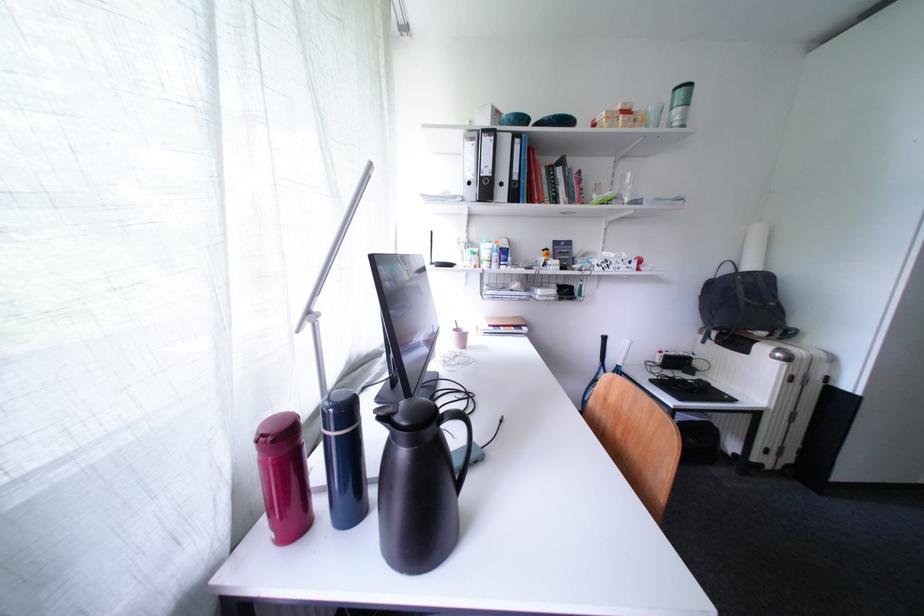
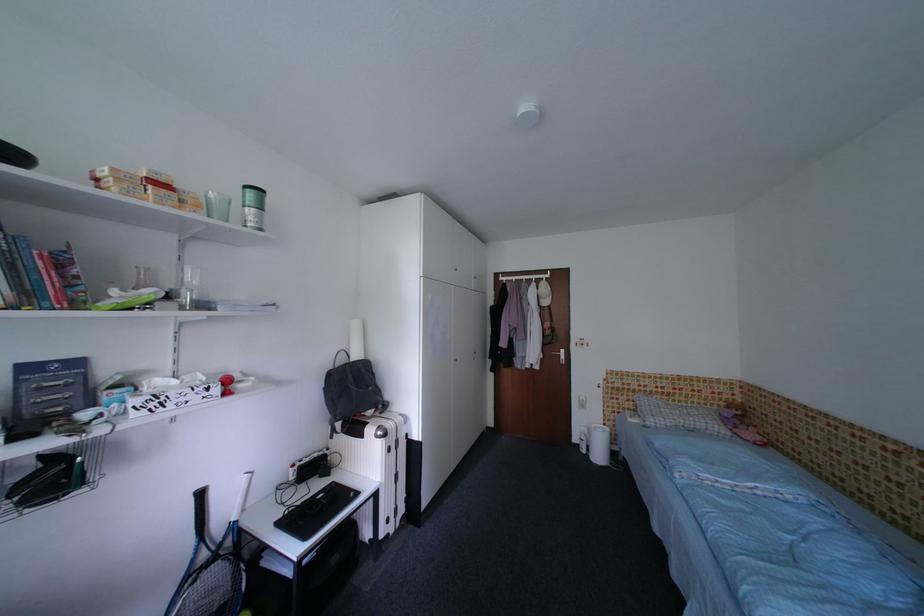
Question: Based on the continuous images, in which direction is the camera rotating? Reply with the corresponding letter.

Choices:
 (A) Left
 (B) Right
 (C) Up
 (D) Down

Answer: (B)